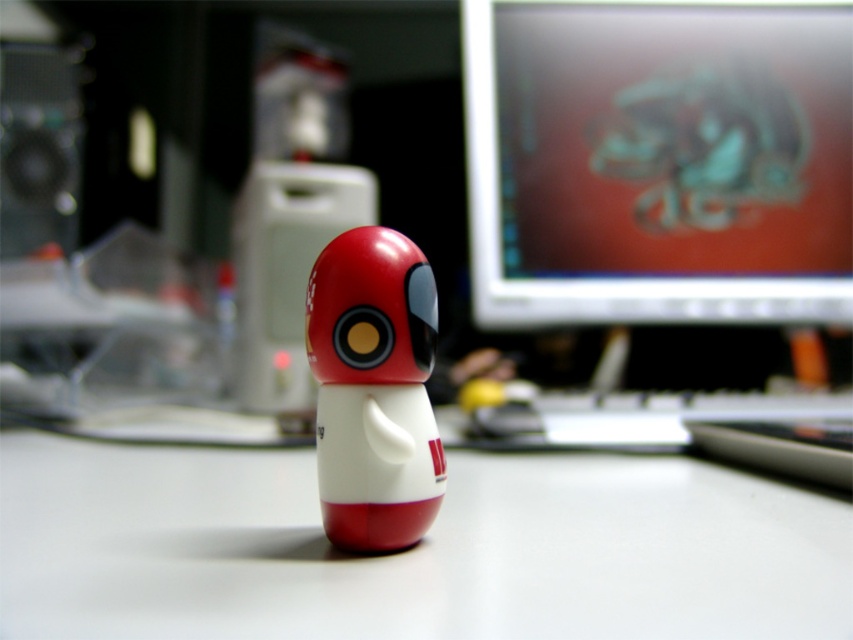
Question: Is white matte computer desk at center bigger than matte plastic toy at center?

Choices:
 (A) no
 (B) yes

Answer: (B)

Question: Which object is positioned farthest from the matte plastic toy at center?

Choices:
 (A) white matte computer desk at center
 (B) matte plastic monitor at upper right

Answer: (B)

Question: Is white matte computer desk at center to the right of matte plastic toy at center from the viewer's perspective?

Choices:
 (A) yes
 (B) no

Answer: (B)

Question: Which point appears farthest from the camera in this image?

Choices:
 (A) (695, 184)
 (B) (280, 625)
 (C) (431, 333)

Answer: (A)

Question: Which object appears closest to the camera in this image?

Choices:
 (A) matte plastic monitor at upper right
 (B) matte plastic toy at center

Answer: (B)

Question: Does white matte computer desk at center have a larger size compared to matte plastic toy at center?

Choices:
 (A) no
 (B) yes

Answer: (B)